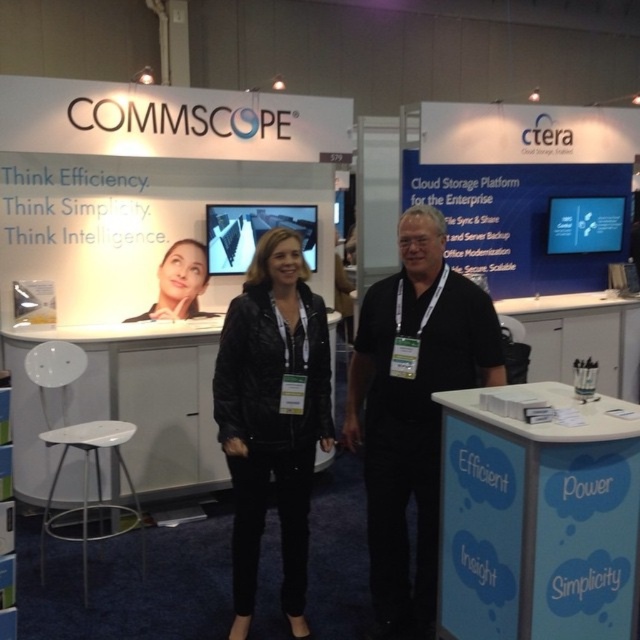
Question: Can you confirm if white plastic desk at center is thinner than matte black jacket at center?

Choices:
 (A) yes
 (B) no

Answer: (B)

Question: Which of the following is the closest to the observer?

Choices:
 (A) 531,426
 (B) 202,292
 (C) 365,417

Answer: (A)

Question: Does black matte shirt at center come in front of white plastic desk at center?

Choices:
 (A) yes
 (B) no

Answer: (A)

Question: Which object is farther from the camera taking this photo?

Choices:
 (A) white plastic desk at center
 (B) matte black jacket at center
 (C) blue paperboard at center

Answer: (B)

Question: Among these objects, which one is farthest from the camera?

Choices:
 (A) white plastic stool at lower left
 (B) black matte shirt at center
 (C) matte black jacket at center
 (D) white plastic desk at center

Answer: (C)

Question: Does white plastic stool at lower left appear over matte black jacket at center?

Choices:
 (A) yes
 (B) no

Answer: (B)